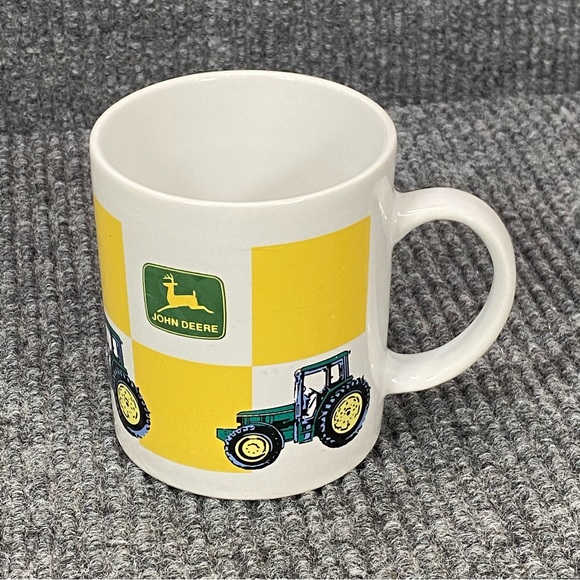
Locate an element on the screen. mug handle is located at coordinates (506, 300).